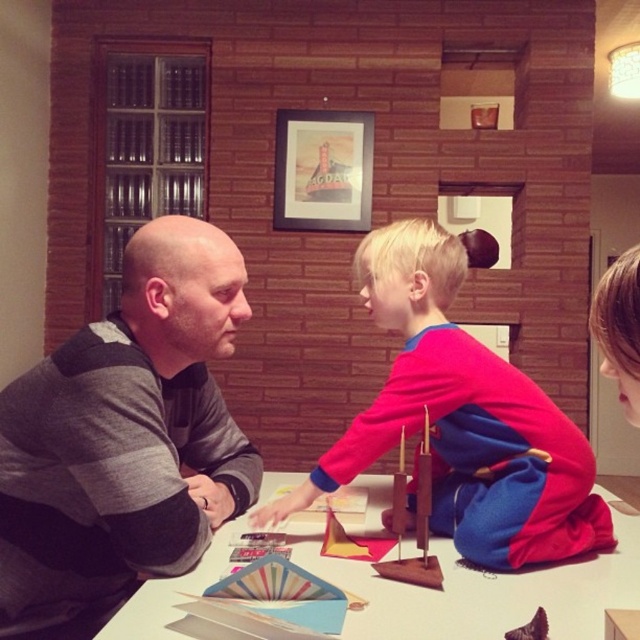
You are standing in front of the table where the craft activity is happening. The gray sweater at left is located at coordinates point [124,436]. If you want to place a tool exactly at this point, where should you put it relative to the gray sweater at left?

The point [124,436] marks the location of the gray sweater at left, so placing a tool at this point would mean placing it directly on the gray sweater at left.

You are a delivery robot with a 15 inch wide package that needs to be placed between the gray sweater at left and the wooden model ship at center. Can the package fit in the space between them?

The gray sweater at left is 17.53 inches away from the wooden model ship at center, so yes, the 15 inch wide package can fit in the space between them since the distance is greater than the package width.